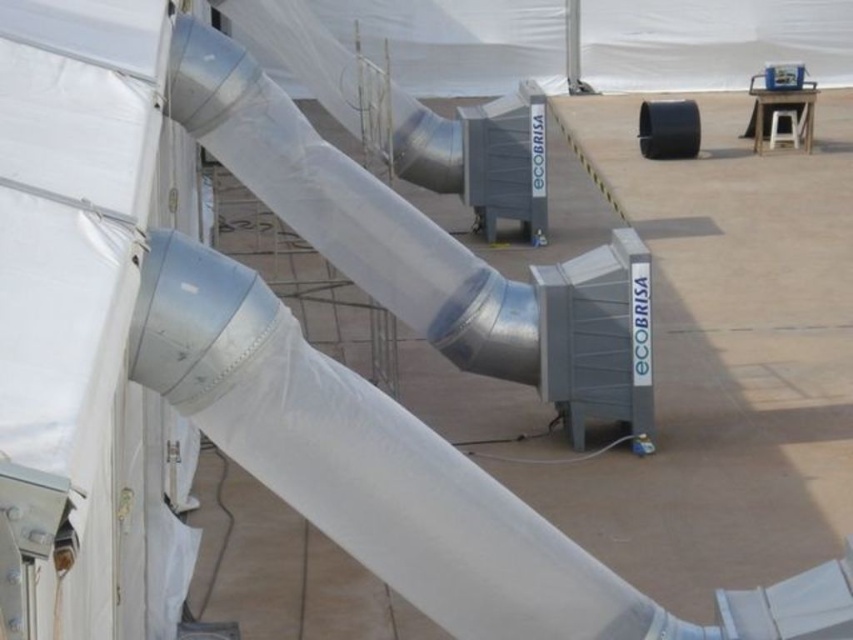
Is silver metallic pole at upper center further to the viewer compared to white plastic stool at upper right?

Yes.

Which of these two, silver metallic pole at upper center or white plastic stool at upper right, stands taller?

silver metallic pole at upper center is taller.

Identify the location of silver metallic pole at upper center. This screenshot has width=853, height=640. (572, 45).